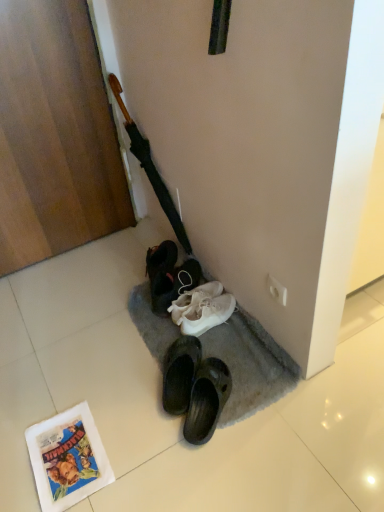
Locate an element on the screen. white paper comic book at lower left is located at coordinates click(x=67, y=458).

Find the location of a particular element. gray carpet at lower center is located at coordinates (250, 365).

Describe the element at coordinates (169, 276) in the screenshot. The image size is (384, 512). I see `white fabric shoe at lower center` at that location.

The width and height of the screenshot is (384, 512). In order to click on wooden crucifix at upper left in this screenshot , I will do `click(150, 167)`.

The height and width of the screenshot is (512, 384). In order to click on wooden door at left in this screenshot , I will do `click(55, 135)`.

Identify the location of door above the wooden crucifix at upper left (from the image's perspective). (55, 135).

Is wooden crucifix at upper left aimed at wooden door at left?

Yes, wooden crucifix at upper left is turned towards wooden door at left.

Relative to wooden door at left, is wooden crucifix at upper left in front or behind?

Clearly, wooden crucifix at upper left is behind wooden door at left.

Is point (117, 91) closer to viewer compared to point (91, 179)?

Yes.

Is white fabric shoe at lower center at the back of wooden crucifix at upper left?

No, wooden crucifix at upper left is not facing away from white fabric shoe at lower center.

Considering the relative sizes of wooden crucifix at upper left and white fabric shoe at lower center in the image provided, is wooden crucifix at upper left bigger than white fabric shoe at lower center?

Yes.

From the image's perspective, would you say wooden crucifix at upper left is shown under white fabric shoe at lower center?

Actually, wooden crucifix at upper left appears above white fabric shoe at lower center in the image.

Which of these two, wooden crucifix at upper left or white fabric shoe at lower center, stands taller?

wooden crucifix at upper left is taller.

Measure the distance from white fabric shoe at lower center to gray carpet at lower center.

19.97 centimeters.

Which is more to the left, white fabric shoe at lower center or gray carpet at lower center?

From the viewer's perspective, white fabric shoe at lower center appears more on the left side.

Is white fabric shoe at lower center wider or thinner than gray carpet at lower center?

white fabric shoe at lower center is thinner than gray carpet at lower center.

Is white fabric shoe at lower center bigger than gray carpet at lower center?

Incorrect, white fabric shoe at lower center is not larger than gray carpet at lower center.

Can you confirm if white fabric shoe at lower center is thinner than wooden crucifix at upper left?

In fact, white fabric shoe at lower center might be wider than wooden crucifix at upper left.

Considering the relative positions of white fabric shoe at lower center and wooden crucifix at upper left in the image provided, is white fabric shoe at lower center to the right of wooden crucifix at upper left from the viewer's perspective?

Yes.

From the image's perspective, relative to wooden crucifix at upper left, is white fabric shoe at lower center above or below?

white fabric shoe at lower center is below wooden crucifix at upper left.

Is white paper comic book at lower left bigger or smaller than wooden door at left?

Clearly, white paper comic book at lower left is smaller in size than wooden door at left.

From the image's perspective, would you say white paper comic book at lower left is positioned over wooden door at left?

Incorrect, from the image's perspective, white paper comic book at lower left is lower than wooden door at left.

Is white paper comic book at lower left outside of wooden door at left?

white paper comic book at lower left lies outside wooden door at left's area.

Does point (57, 495) appear closer or farther from the camera than point (51, 203)?

Point (57, 495) appears to be closer to the viewer than point (51, 203).

Looking at this image, is white fabric shoe at lower center oriented away from white paper comic book at lower left?

No, white fabric shoe at lower center is not facing away from white paper comic book at lower left.

Is white fabric shoe at lower center behind white paper comic book at lower left?

Yes, it is behind white paper comic book at lower left.

Which is more to the left, white fabric shoe at lower center or white paper comic book at lower left?

white paper comic book at lower left is more to the left.

Is white fabric shoe at lower center bigger than white paper comic book at lower left?

Yes.

Does gray carpet at lower center have a larger size compared to wooden door at left?

No.

Looking at this image, is the surface of gray carpet at lower center in direct contact with wooden door at left?

No, gray carpet at lower center is not beside wooden door at left.

Considering the sizes of objects gray carpet at lower center and wooden door at left in the image provided, who is thinner, gray carpet at lower center or wooden door at left?

Thinner between the two is wooden door at left.

Where is `door in front of the wooden crucifix at upper left`? door in front of the wooden crucifix at upper left is located at coordinates (55, 135).

Image resolution: width=384 pixels, height=512 pixels. What are the coordinates of `footwear below the wooden crucifix at upper left (from a real-world perspective)` in the screenshot? It's located at (169, 276).

When comparing their distances from white paper comic book at lower left, does wooden door at left or white fabric shoe at lower center seem closer?

Based on the image, white fabric shoe at lower center appears to be nearer to white paper comic book at lower left.

From the image, which object appears to be nearer to white fabric shoe at lower center, white paper comic book at lower left or gray carpet at lower center?

The object closer to white fabric shoe at lower center is gray carpet at lower center.

Based on the photo, which object lies further to the anchor point wooden door at left, white fabric shoe at lower center or wooden crucifix at upper left?

white fabric shoe at lower center is further to wooden door at left.

Which object lies nearer to the anchor point white fabric shoe at lower center, white paper comic book at lower left or wooden crucifix at upper left?

wooden crucifix at upper left is closer to white fabric shoe at lower center.

Based on their spatial positions, is wooden crucifix at upper left or wooden door at left further from white paper comic book at lower left?

Based on the image, wooden door at left appears to be further to white paper comic book at lower left.

Looking at this image, considering their positions, is wooden crucifix at upper left positioned closer to gray carpet at lower center than white paper comic book at lower left?

white paper comic book at lower left is closer to gray carpet at lower center.

Estimate the real-world distances between objects in this image. Which object is closer to wooden crucifix at upper left, gray carpet at lower center or wooden door at left?

The object closer to wooden crucifix at upper left is wooden door at left.

Which object lies nearer to the anchor point wooden door at left, gray carpet at lower center or white paper comic book at lower left?

gray carpet at lower center is closer to wooden door at left.

Where is `footwear between wooden crucifix at upper left and white paper comic book at lower left in the vertical direction`? footwear between wooden crucifix at upper left and white paper comic book at lower left in the vertical direction is located at coordinates (169, 276).

You are a GUI agent. You are given a task and a screenshot of the screen. Output one action in this format:
    pyautogui.click(x=<x>, y=<y>)
    Task: Click on the doormat that lies between wooden door at left and white paper comic book at lower left from top to bottom
    This screenshot has height=512, width=384.
    Given the screenshot: What is the action you would take?
    pyautogui.click(x=250, y=365)

Locate an element on the screen. The width and height of the screenshot is (384, 512). crucifix that lies between wooden door at left and white paper comic book at lower left from top to bottom is located at coordinates (150, 167).

Identify the location of footwear between wooden door at left and white paper comic book at lower left from top to bottom. The image size is (384, 512). (169, 276).